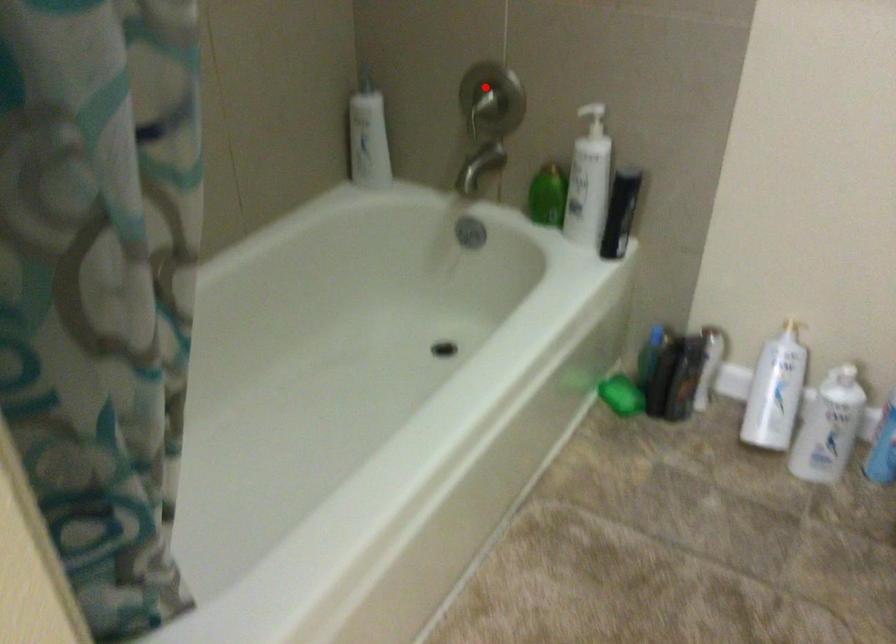
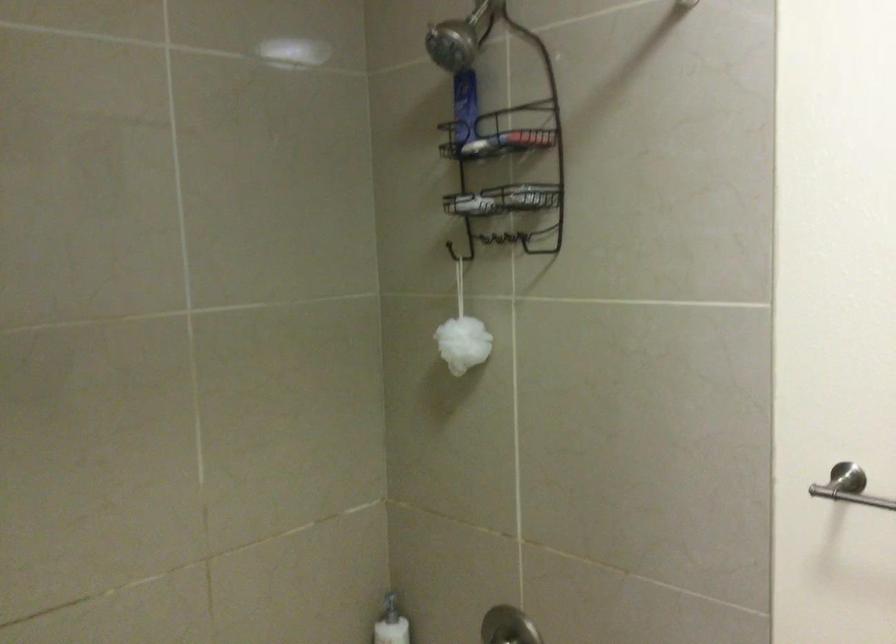
Question: I am providing you with two images of the same scene from different viewpoints. Image1 has a red point marked. In image2, the corresponding 3D location appears at what relative position? Reply with the corresponding letter.

Choices:
 (A) Closer
 (B) Farther

Answer: (A)